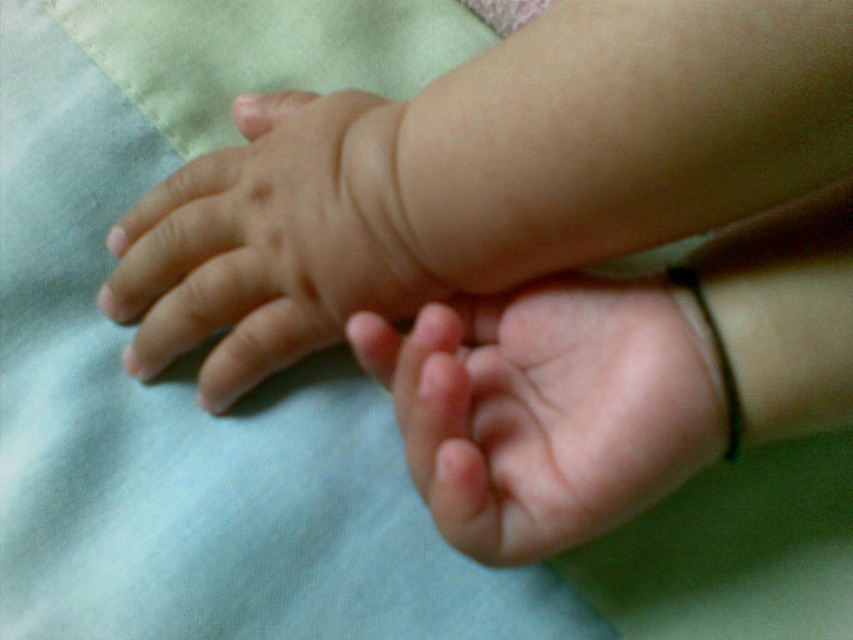
You are designing a custom glove that needs to fit both the smooth skin hand at upper left and the pink soft skin at center. Based on their sizes, which hand requires a larger glove size?

The smooth skin hand at upper left requires a larger glove size because it might be wider than the pink soft skin at center.

You are a photographer trying to focus on the smooth skin hand at center in the image. You notice a point labeled as point (x=555, y=412). Can you confirm if this point is located on the smooth skin hand at center?

Yes, the point (x=555, y=412) is located on the smooth skin hand at center according to the description.